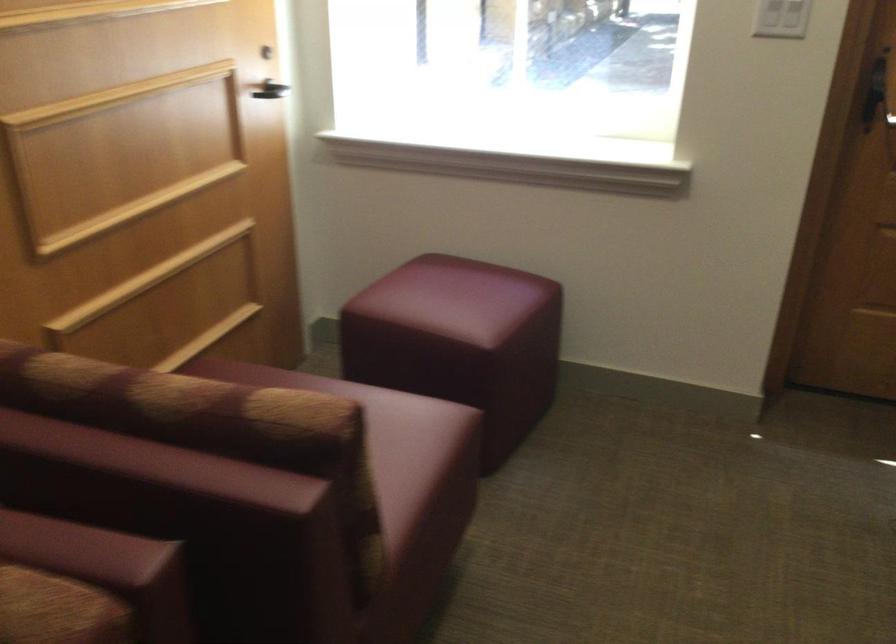
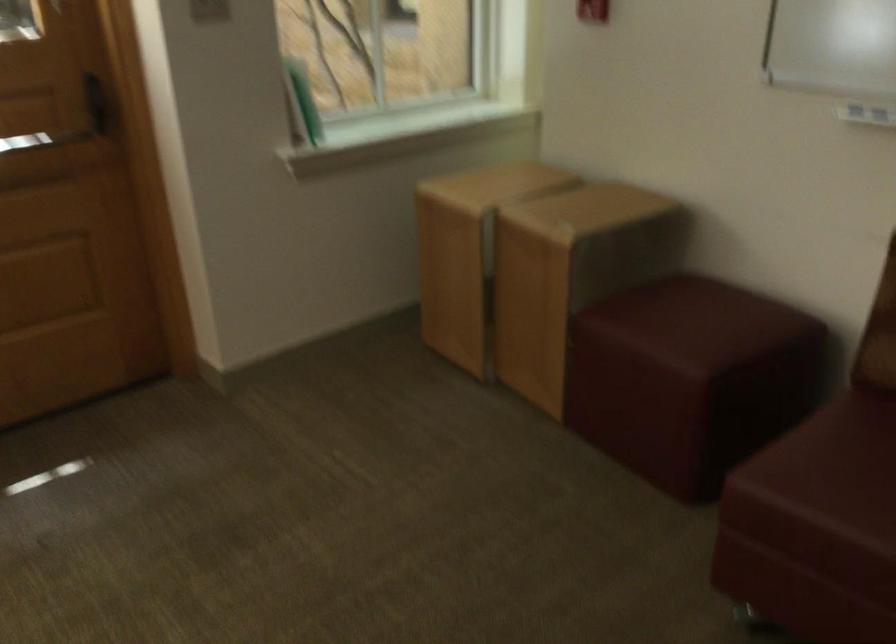
Question: Based on the continuous images, in which direction is the camera rotating? Reply with the corresponding letter.

Choices:
 (A) Left
 (B) Right
 (C) Up
 (D) Down

Answer: (B)